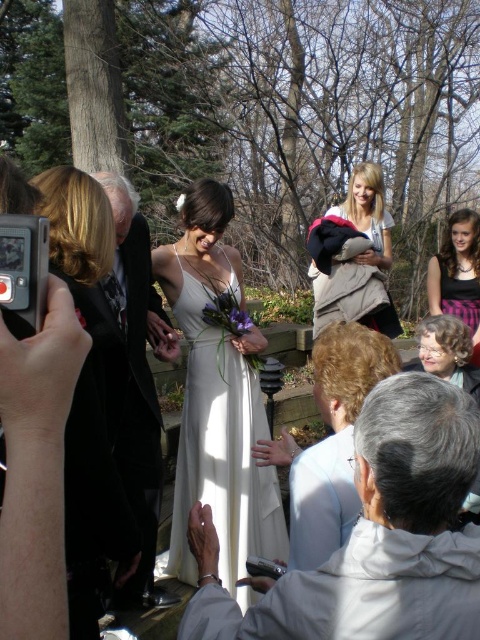
Is point (136, 321) farther from viewer compared to point (470, 490)?

Yes, it is behind point (470, 490).

Which is behind, point (136, 230) or point (466, 324)?

Point (466, 324)

This screenshot has width=480, height=640. What do you see at coordinates (139, 378) in the screenshot? I see `black leather shoes at center` at bounding box center [139, 378].

This screenshot has height=640, width=480. In order to click on black leather shoes at center in this screenshot , I will do `click(139, 378)`.

Is black leather shoes at center above plaid fabric dress at center?

Incorrect, black leather shoes at center is not positioned above plaid fabric dress at center.

Looking at this image, which is above, black leather shoes at center or plaid fabric dress at center?

plaid fabric dress at center

Between point (141, 365) and point (468, 232), which one is positioned in front?

Point (141, 365) is more forward.

I want to click on black leather shoes at center, so click(x=139, y=378).

Which is more to the left, white satin dress at left or plaid fabric dress at center?

white satin dress at left

At what (x,y) coordinates should I click in order to perform the action: click on white satin dress at left. Please return your answer as a coordinate pair (x, y). Looking at the image, I should click on (86, 397).

Image resolution: width=480 pixels, height=640 pixels. What do you see at coordinates (86, 397) in the screenshot?
I see `white satin dress at left` at bounding box center [86, 397].

I want to click on white satin dress at left, so click(86, 397).